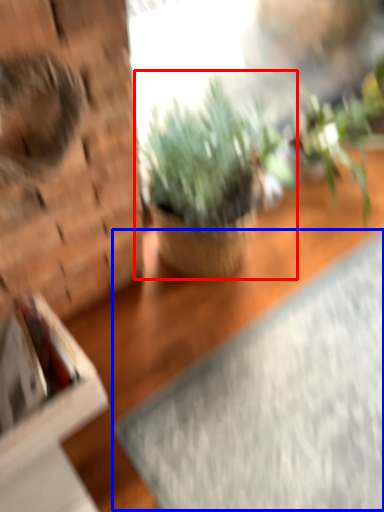
Question: Which point is further to the camera, houseplant (highlighted by a red box) or yoga mat (highlighted by a blue box)?

Choices:
 (A) houseplant
 (B) yoga mat

Answer: (B)